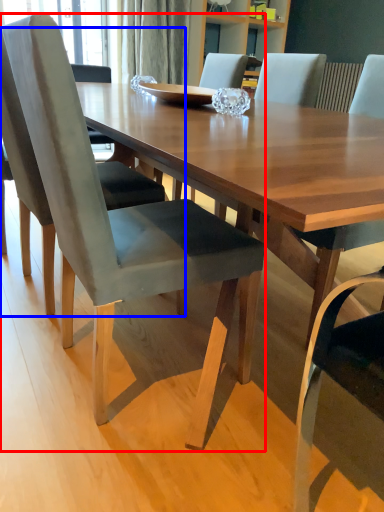
Question: Among these objects, which one is farthest to the camera, chair (highlighted by a red box) or chair (highlighted by a blue box)?

Choices:
 (A) chair
 (B) chair

Answer: (B)